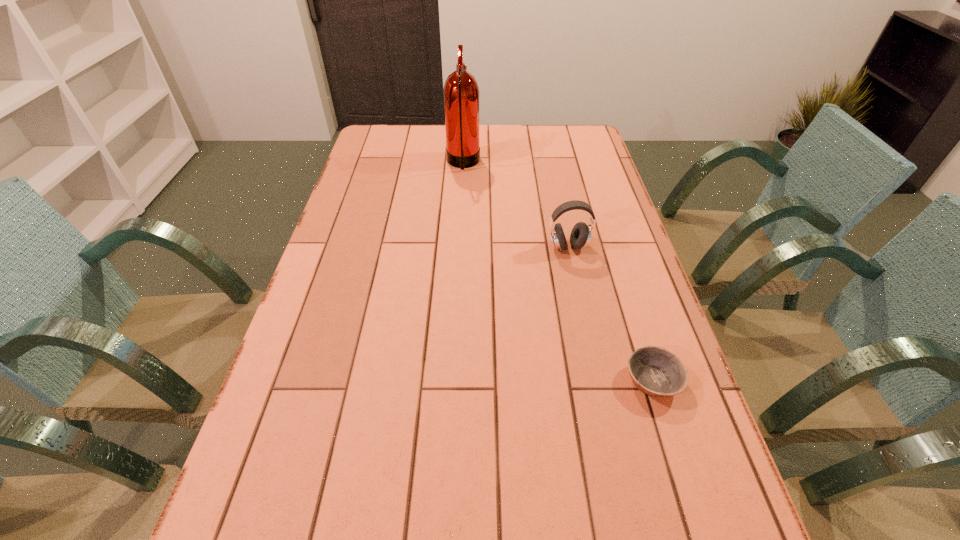
I want to click on headset located at the right edge, so click(580, 236).

The image size is (960, 540). In order to click on bowl positioned at the right edge in this screenshot , I will do `click(655, 371)`.

What are the coordinates of `vacant space at the far edge of the desktop` in the screenshot? It's located at point(535,146).

Locate an element on the screen. Image resolution: width=960 pixels, height=540 pixels. vacant space at the left edge of the desktop is located at coordinates (312, 281).

Where is `free space at the right edge`? free space at the right edge is located at coordinates pos(574,172).

The height and width of the screenshot is (540, 960). What are the coordinates of `free region at the far left corner of the desktop` in the screenshot? It's located at click(x=399, y=146).

Find the location of a particular element. vacant area at the far right corner is located at coordinates (573, 133).

Identify the location of unoccupied area between the bowl and the second shortest object. (611, 313).

Find the location of a particular element. The width and height of the screenshot is (960, 540). empty location between the headset and the bowl is located at coordinates coord(611,313).

Identify the location of free space that is in between the shortest object and the second tallest object. This screenshot has width=960, height=540. (611, 313).